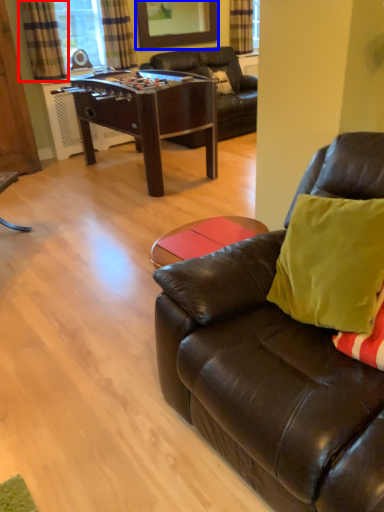
Question: Which object appears farthest to the camera in this image, curtain (highlighted by a red box) or mirror (highlighted by a blue box)?

Choices:
 (A) curtain
 (B) mirror

Answer: (B)